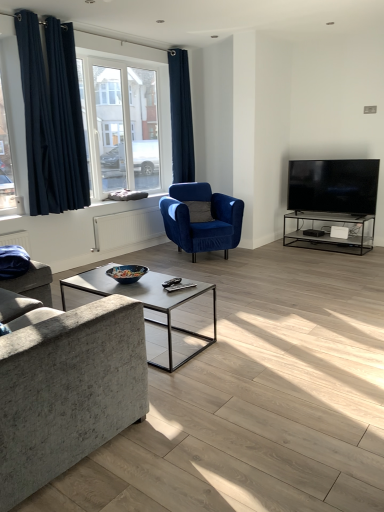
Question: Relative to textured gray fabric couch at left, is clear glass window at upper left in front or behind?

Choices:
 (A) behind
 (B) front

Answer: (A)

Question: From their relative heights in the image, would you say clear glass window at upper left is taller or shorter than textured gray fabric couch at left?

Choices:
 (A) tall
 (B) short

Answer: (A)

Question: Estimate the real-world distances between objects in this image. Which object is farther from the dark blue velvet curtains at left, which appears as the first curtain when viewed from the left?

Choices:
 (A) clear glass window at upper left
 (B) textured gray fabric couch at left
 (C) velvet blue armchair at center
 (D) dark blue velvet curtain at upper center, the 2th curtain viewed from the left

Answer: (B)

Question: Which object is the closest to the velvet blue armchair at center?

Choices:
 (A) dark blue velvet curtains at left, which appears as the first curtain when viewed from the left
 (B) clear glass window at upper left
 (C) textured gray fabric couch at left
 (D) dark blue velvet curtain at upper center, the 2th curtain viewed from the left

Answer: (B)